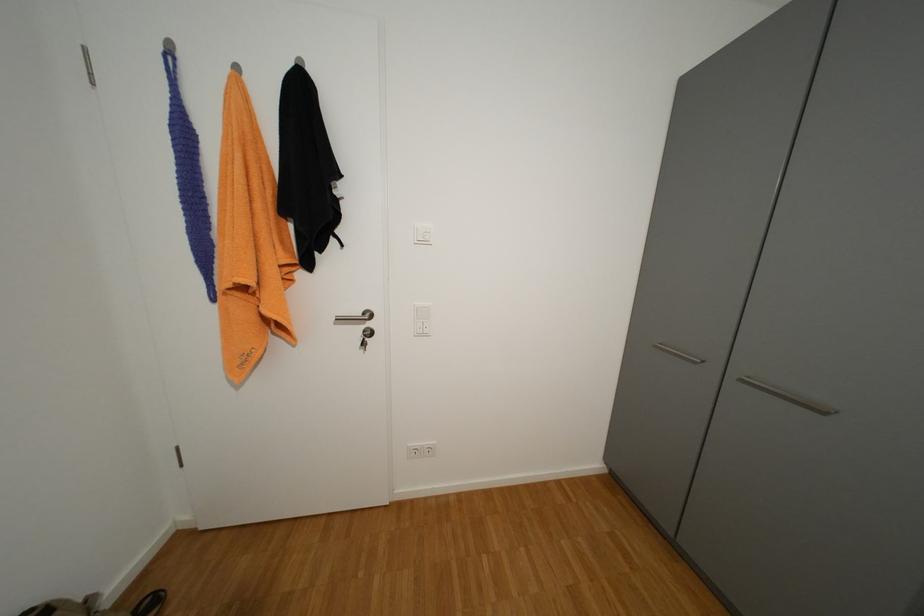
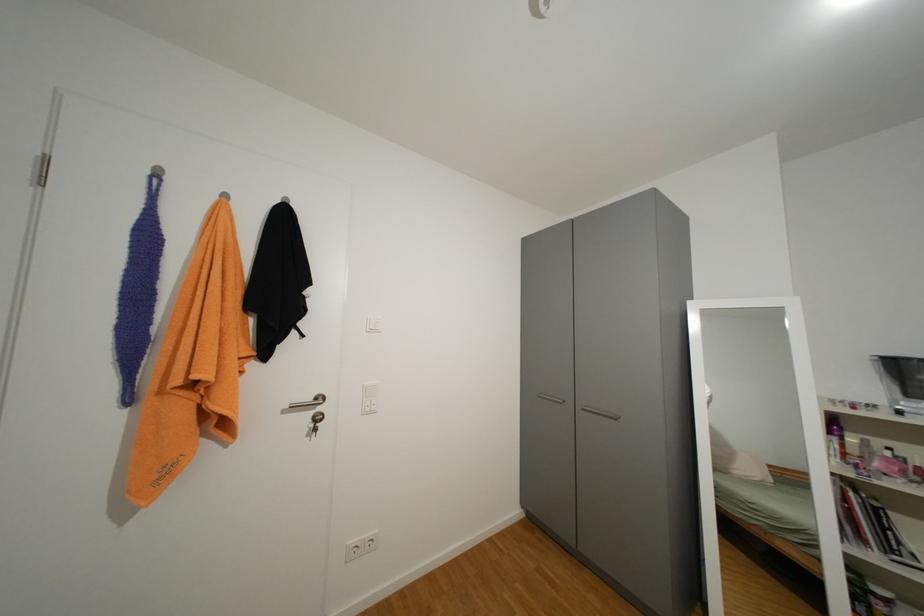
Based on the continuous images, in which direction is the camera rotating?

The rotation direction of the camera is right-up.